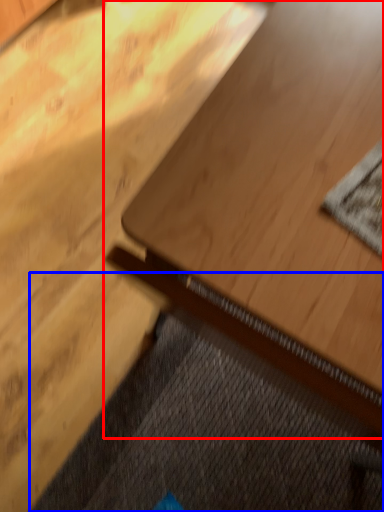
Question: Which object is further to the camera taking this photo, table (highlighted by a red box) or doormat (highlighted by a blue box)?

Choices:
 (A) table
 (B) doormat

Answer: (B)